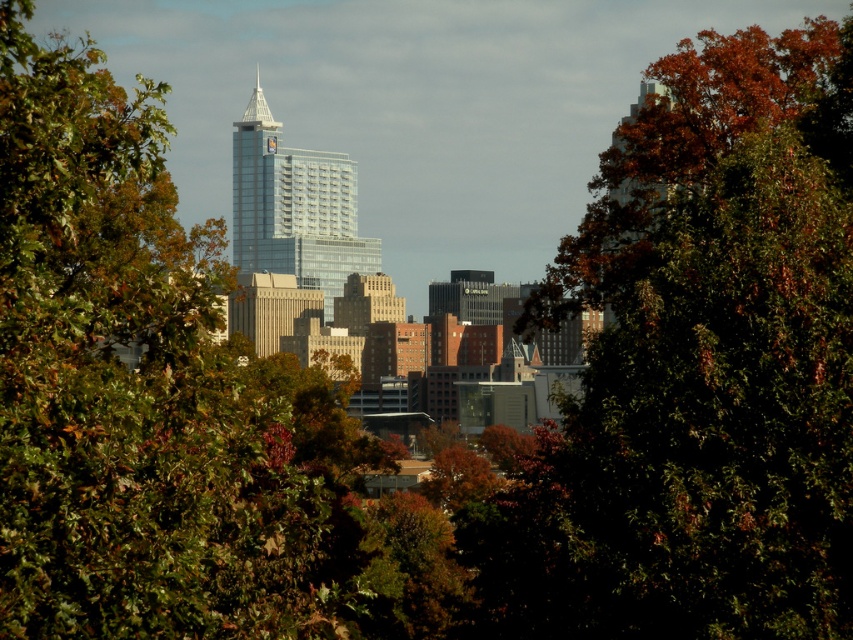
Who is shorter, autumn leaves at center or transparent glass skyscraper at center?

transparent glass skyscraper at center

Who is more distant from viewer, (598, 259) or (334, 257)?

Point (598, 259)

You are a GUI agent. You are given a task and a screenshot of the screen. Output one action in this format:
    pyautogui.click(x=<x>, y=<y>)
    Task: Click on the autumn leaves at center
    
    Given the screenshot: What is the action you would take?
    pyautogui.click(x=711, y=356)

Can you confirm if green leafy tree at center is positioned to the left of transparent glass skyscraper at center?

Yes, green leafy tree at center is to the left of transparent glass skyscraper at center.

Describe the element at coordinates (146, 394) in the screenshot. I see `green leafy tree at center` at that location.

Is point (0, 246) farther from viewer compared to point (241, 188)?

No.

Where is `green leafy tree at center`? green leafy tree at center is located at coordinates (146, 394).

Can you confirm if autumn leaves at center is positioned to the right of green leafy tree at center?

Correct, you'll find autumn leaves at center to the right of green leafy tree at center.

Can you confirm if autumn leaves at center is thinner than green leafy tree at center?

Correct, autumn leaves at center's width is less than green leafy tree at center's.

Is point (735, 472) closer to viewer compared to point (143, 460)?

No.

Where is `autumn leaves at center`? The image size is (853, 640). autumn leaves at center is located at coordinates (711, 356).